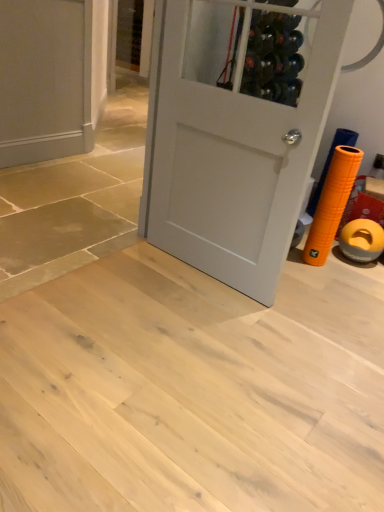
Locate an element on the screen. vacant space to the right of white matte door at center, the 2th door when ordered from left to right is located at coordinates (324, 300).